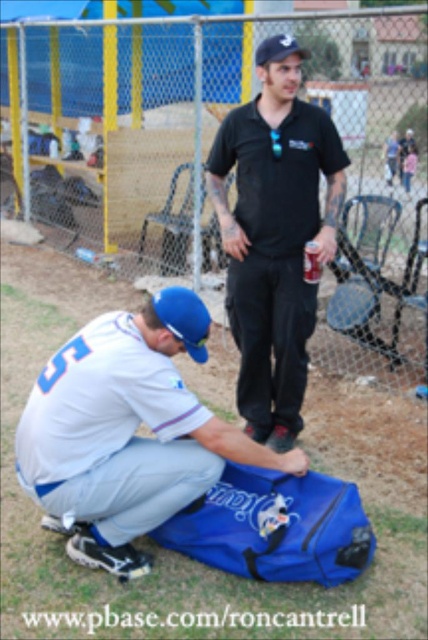
Describe the element at coordinates (127, 433) in the screenshot. I see `blue fabric bag at lower center` at that location.

Between blue fabric bag at lower center and black matte shirt at center, which one is positioned lower?

blue fabric bag at lower center

What do you see at coordinates (127, 433) in the screenshot? The image size is (428, 640). I see `blue fabric bag at lower center` at bounding box center [127, 433].

I want to click on blue fabric bag at lower center, so click(x=127, y=433).

Can you confirm if black matte shirt at center is wider than blue fabric baseball bag at upper right?

Correct, the width of black matte shirt at center exceeds that of blue fabric baseball bag at upper right.

Who is lower down, black matte shirt at center or blue fabric baseball bag at upper right?

black matte shirt at center is lower down.

Consider the image. Who is more forward, (262, 336) or (406, 145)?

Point (262, 336) is in front.

The height and width of the screenshot is (640, 428). Identify the location of black matte shirt at center. (275, 234).

Can you confirm if blue fabric bag at lower center is positioned to the right of blue fabric baseball bag at upper right?

No, blue fabric bag at lower center is not to the right of blue fabric baseball bag at upper right.

Between point (115, 541) and point (398, 157), which one is positioned behind?

Point (398, 157)

Where is `blue fabric bag at lower center`? The width and height of the screenshot is (428, 640). blue fabric bag at lower center is located at coordinates (127, 433).